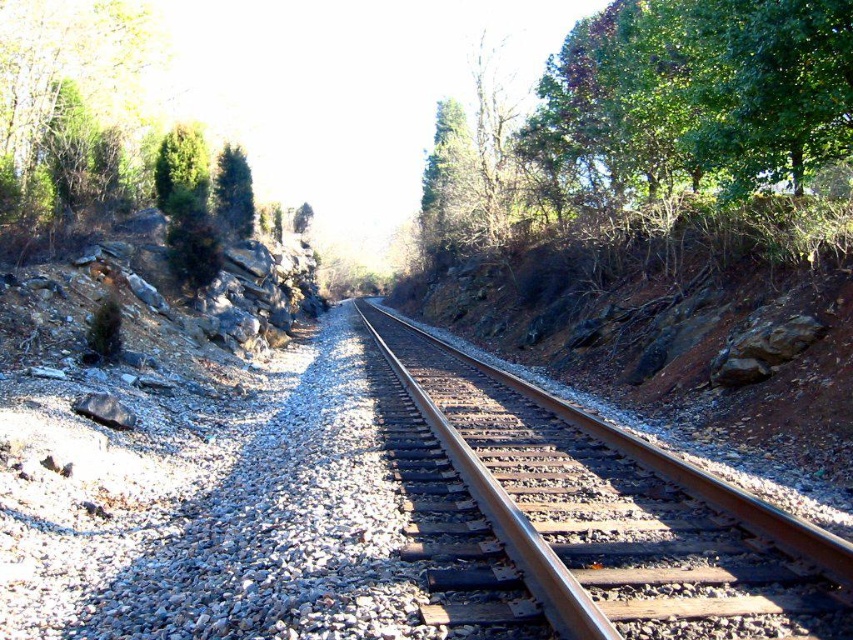
Is metal train track at center thinner than green matte tree at upper left?

No.

Between point (532, 572) and point (245, 161), which one is positioned in front?

Point (532, 572) is more forward.

Describe the element at coordinates (590, 516) in the screenshot. I see `metal train track at center` at that location.

The width and height of the screenshot is (853, 640). In order to click on metal train track at center in this screenshot , I will do `click(590, 516)`.

Between metal train track at center and green leafy tree at upper right, which one has more height?

green leafy tree at upper right

Based on the photo, between metal train track at center and green leafy tree at upper right, which one is positioned higher?

Positioned higher is green leafy tree at upper right.

What do you see at coordinates (590, 516) in the screenshot? I see `metal train track at center` at bounding box center [590, 516].

In order to click on metal train track at center in this screenshot , I will do `click(590, 516)`.

Is green leafy tree at upper right wider than green matte tree at upper left?

Yes, green leafy tree at upper right is wider than green matte tree at upper left.

Where is `green leafy tree at upper right`? The width and height of the screenshot is (853, 640). green leafy tree at upper right is located at coordinates (651, 116).

Where is `green leafy tree at upper right`? This screenshot has width=853, height=640. green leafy tree at upper right is located at coordinates (651, 116).

The image size is (853, 640). Identify the location of green leafy tree at upper right. (651, 116).